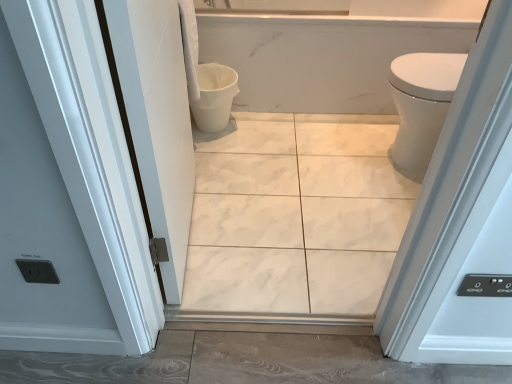
Question: Does white glossy bidet at right have a greater height compared to white matte toilet bowl at center?

Choices:
 (A) no
 (B) yes

Answer: (B)

Question: From the image's perspective, does white glossy bidet at right appear lower than white matte toilet bowl at center?

Choices:
 (A) yes
 (B) no

Answer: (A)

Question: Does white glossy bidet at right turn towards white matte toilet bowl at center?

Choices:
 (A) no
 (B) yes

Answer: (B)

Question: Is white glossy bidet at right at the left side of white matte toilet bowl at center?

Choices:
 (A) yes
 (B) no

Answer: (B)

Question: From the image's perspective, is white glossy bidet at right on white matte toilet bowl at center?

Choices:
 (A) no
 (B) yes

Answer: (A)

Question: Would you say white glossy bidet at right is a long distance from white matte toilet bowl at center?

Choices:
 (A) yes
 (B) no

Answer: (B)

Question: From a real-world perspective, is white marble tile at center on top of white glossy door at left?

Choices:
 (A) no
 (B) yes

Answer: (A)

Question: Can you confirm if white marble tile at center is shorter than white glossy door at left?

Choices:
 (A) yes
 (B) no

Answer: (A)

Question: Can you confirm if white marble tile at center is positioned to the right of white glossy door at left?

Choices:
 (A) no
 (B) yes

Answer: (B)

Question: Is white marble tile at center behind white glossy door at left?

Choices:
 (A) yes
 (B) no

Answer: (A)

Question: Is white marble tile at center facing away from white glossy door at left?

Choices:
 (A) no
 (B) yes

Answer: (A)

Question: Is white marble tile at center positioned far away from white glossy door at left?

Choices:
 (A) yes
 (B) no

Answer: (B)

Question: From the image's perspective, is white glossy door at left beneath white marble tile at center?

Choices:
 (A) no
 (B) yes

Answer: (A)